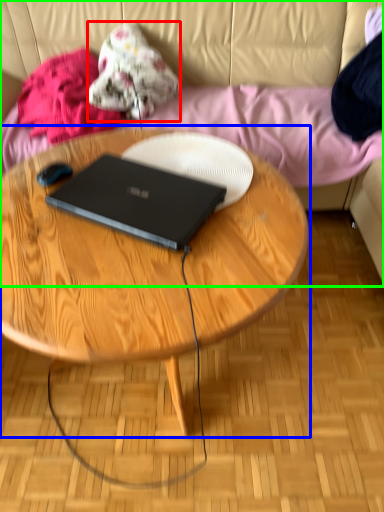
Question: Which is farther away from clothing (highlighted by a red box)? coffee table (highlighted by a blue box) or studio couch (highlighted by a green box)?

Choices:
 (A) coffee table
 (B) studio couch

Answer: (A)